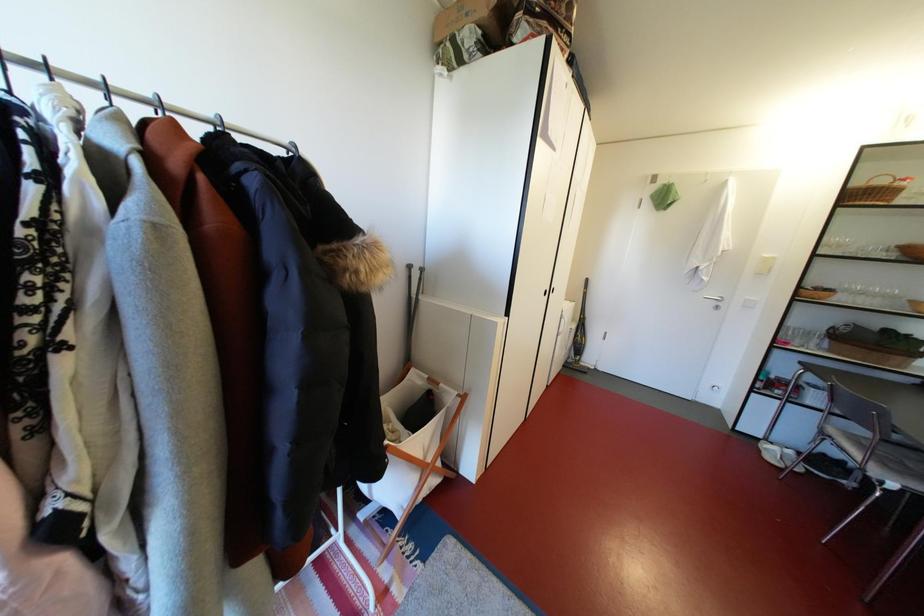
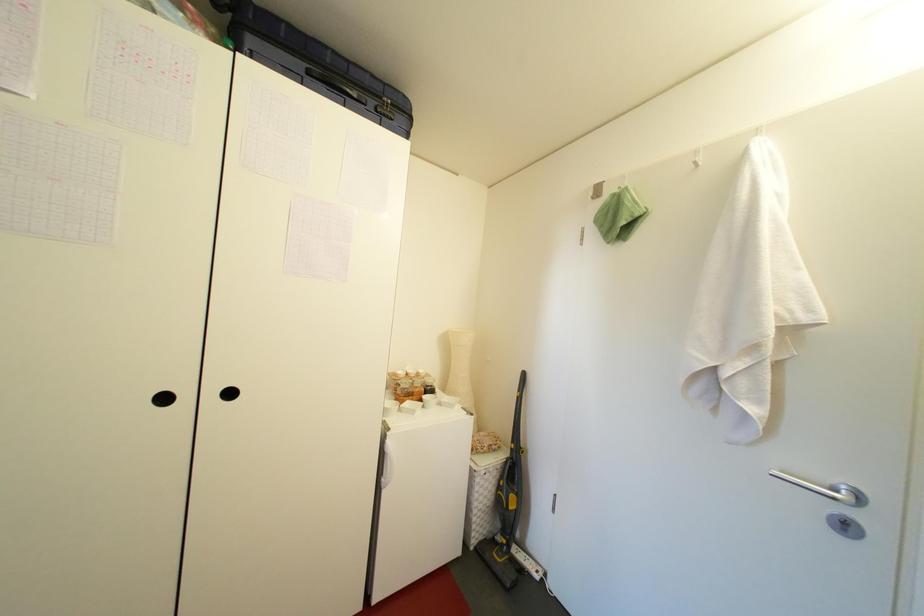
The images are taken continuously from a first-person perspective. In which direction are you moving?

The movement direction of the cameraman is right, forward.